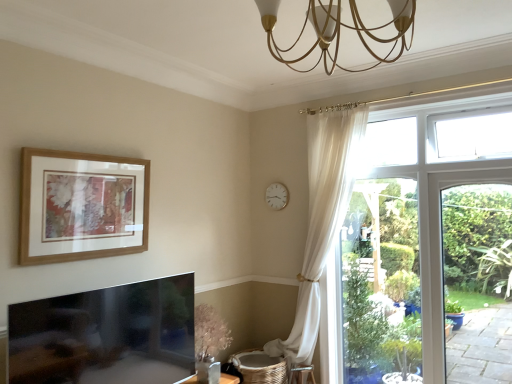
Where is `wooden picture frame at upper left`? The width and height of the screenshot is (512, 384). wooden picture frame at upper left is located at coordinates (81, 206).

The width and height of the screenshot is (512, 384). Describe the element at coordinates (277, 196) in the screenshot. I see `white plastic clock at upper center` at that location.

Find the location of a particular element. wooden picture frame at upper left is located at coordinates (81, 206).

Which is in front, gold metallic chandelier at upper center or white plastic clock at upper center?

gold metallic chandelier at upper center.

Based on their sizes in the image, would you say gold metallic chandelier at upper center is bigger or smaller than white plastic clock at upper center?

gold metallic chandelier at upper center is bigger than white plastic clock at upper center.

Consider the image. Is gold metallic chandelier at upper center with white plastic clock at upper center?

No, gold metallic chandelier at upper center is not touching white plastic clock at upper center.

Can you confirm if wooden picture frame at upper left is thinner than gold metallic chandelier at upper center?

Correct, the width of wooden picture frame at upper left is less than that of gold metallic chandelier at upper center.

Is wooden picture frame at upper left facing towards gold metallic chandelier at upper center?

Yes, wooden picture frame at upper left is facing gold metallic chandelier at upper center.

Would you say wooden picture frame at upper left is inside or outside gold metallic chandelier at upper center?

The correct answer is: outside.

From a real-world perspective, is wooden picture frame at upper left positioned above or below gold metallic chandelier at upper center?

wooden picture frame at upper left is situated lower than gold metallic chandelier at upper center in the real world.

Is gold metallic chandelier at upper center not close to wooden picture frame at upper left?

Yes, gold metallic chandelier at upper center is far from wooden picture frame at upper left.

The width and height of the screenshot is (512, 384). Identify the location of light fixture that appears above the wooden picture frame at upper left (from a real-world perspective). (339, 31).

Is wooden picture frame at upper left completely or partially inside gold metallic chandelier at upper center?

No, gold metallic chandelier at upper center does not contain wooden picture frame at upper left.

Is point (324, 47) in front of point (91, 162)?

Yes, point (324, 47) is in front of point (91, 162).

Considering the sizes of wooden picture frame at upper left and white plastic clock at upper center in the image, is wooden picture frame at upper left bigger or smaller than white plastic clock at upper center?

Clearly, wooden picture frame at upper left is larger in size than white plastic clock at upper center.

From a real-world perspective, is wooden picture frame at upper left physically below white plastic clock at upper center?

Indeed, from a real-world perspective, wooden picture frame at upper left is positioned beneath white plastic clock at upper center.

Which of these two, wooden picture frame at upper left or white plastic clock at upper center, is wider?

With larger width is wooden picture frame at upper left.

In order to click on clock above the wooden picture frame at upper left (from a real-world perspective) in this screenshot , I will do click(277, 196).

Is the depth of white plastic clock at upper center greater than that of wooden picture frame at upper left?

Yes.

Is white plastic clock at upper center positioned with its back to wooden picture frame at upper left?

No.

Are white plastic clock at upper center and wooden picture frame at upper left far apart?

Yes.

Is white plastic clock at upper center wider than gold metallic chandelier at upper center?

No, white plastic clock at upper center is not wider than gold metallic chandelier at upper center.

In terms of size, does white plastic clock at upper center appear bigger or smaller than gold metallic chandelier at upper center?

Clearly, white plastic clock at upper center is smaller in size than gold metallic chandelier at upper center.

From a real-world perspective, who is located higher, white plastic clock at upper center or gold metallic chandelier at upper center?

gold metallic chandelier at upper center, from a real-world perspective.

Consider the image. How many degrees apart are the facing directions of white plastic clock at upper center and gold metallic chandelier at upper center?

The angular difference between white plastic clock at upper center and gold metallic chandelier at upper center is 90 degrees.

Find the location of a particular element. Image resolution: width=512 pixels, height=384 pixels. light fixture to the right of white plastic clock at upper center is located at coordinates (339, 31).

In the image, there is a wooden picture frame at upper left. Where is `light fixture above it (from the image's perspective)`? light fixture above it (from the image's perspective) is located at coordinates (339, 31).

From the picture: Which object lies further to the anchor point gold metallic chandelier at upper center, wooden picture frame at upper left or white plastic clock at upper center?

The object further to gold metallic chandelier at upper center is white plastic clock at upper center.

Which object lies further to the anchor point wooden picture frame at upper left, white plastic clock at upper center or gold metallic chandelier at upper center?

white plastic clock at upper center.

Considering their positions, is gold metallic chandelier at upper center positioned further to white plastic clock at upper center than wooden picture frame at upper left?

The object further to white plastic clock at upper center is gold metallic chandelier at upper center.

From the image, which object appears to be nearer to gold metallic chandelier at upper center, white plastic clock at upper center or wooden picture frame at upper left?

wooden picture frame at upper left lies closer to gold metallic chandelier at upper center than the other object.

Estimate the real-world distances between objects in this image. Which object is closer to white plastic clock at upper center, wooden picture frame at upper left or gold metallic chandelier at upper center?

The object closer to white plastic clock at upper center is wooden picture frame at upper left.

Looking at the image, which one is located closer to wooden picture frame at upper left, gold metallic chandelier at upper center or white plastic clock at upper center?

Based on the image, gold metallic chandelier at upper center appears to be nearer to wooden picture frame at upper left.

Where is `picture frame between gold metallic chandelier at upper center and white plastic clock at upper center from front to back`? This screenshot has width=512, height=384. picture frame between gold metallic chandelier at upper center and white plastic clock at upper center from front to back is located at coordinates (81, 206).